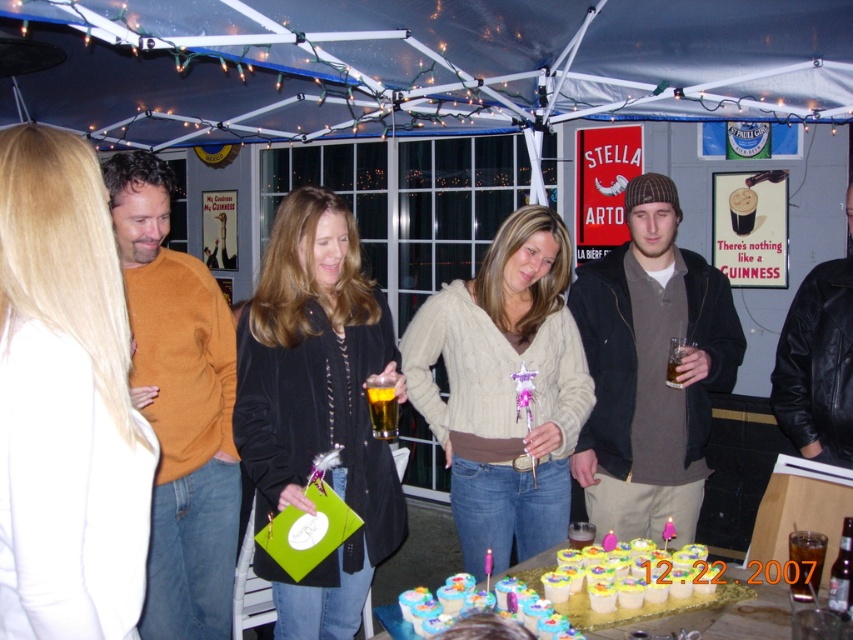
Can you confirm if cable-knit sweater at center is positioned to the left of amber glass beer at center?

Incorrect, cable-knit sweater at center is not on the left side of amber glass beer at center.

Does point (555, 236) come closer to viewer compared to point (386, 392)?

That is False.

Which is in front, point (467, 442) or point (379, 429)?

Point (379, 429) is in front.

This screenshot has height=640, width=853. Identify the location of cable-knit sweater at center. (503, 388).

What do you see at coordinates (317, 404) in the screenshot? This screenshot has width=853, height=640. I see `matte black jacket at center` at bounding box center [317, 404].

What do you see at coordinates (317, 404) in the screenshot? The width and height of the screenshot is (853, 640). I see `matte black jacket at center` at bounding box center [317, 404].

Locate an element on the screen. matte black jacket at center is located at coordinates (317, 404).

Does point (27, 387) come in front of point (799, 563)?

Yes, it is.

From the picture: Does blonde hair at left have a lesser height compared to translucent glass cup at lower center?

No, blonde hair at left is not shorter than translucent glass cup at lower center.

Who is more forward, [15,548] or [798,589]?

Point [15,548] is in front.

Where is `blonde hair at left`? This screenshot has height=640, width=853. blonde hair at left is located at coordinates (65, 401).